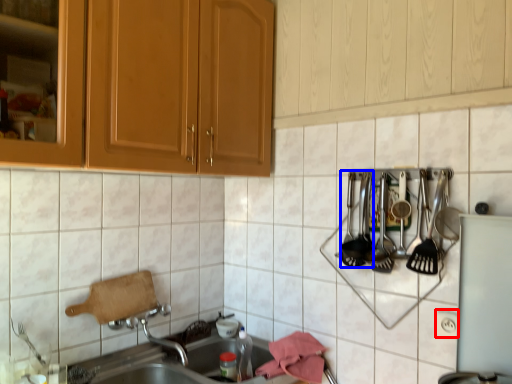
Question: Among these objects, which one is farthest to the camera, electric outlet (highlighted by a red box) or silverware (highlighted by a blue box)?

Choices:
 (A) electric outlet
 (B) silverware

Answer: (B)